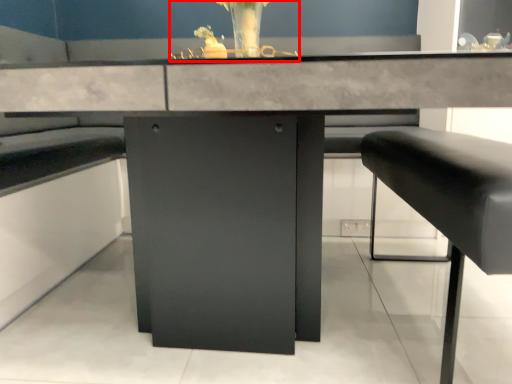
Question: Where is floral arrangement (annotated by the red box) located in relation to furniture in the image?

Choices:
 (A) left
 (B) right

Answer: (A)